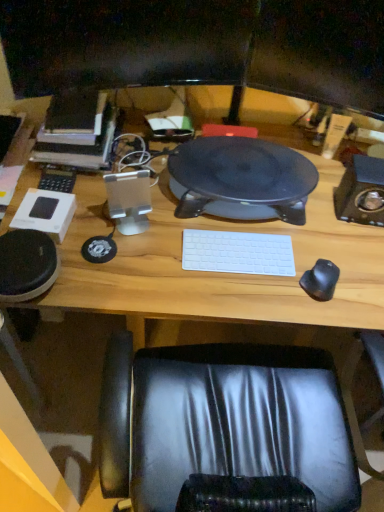
Locate an element on the screen. This screenshot has width=384, height=512. empty space that is to the right of white matte keyboard at center is located at coordinates (312, 263).